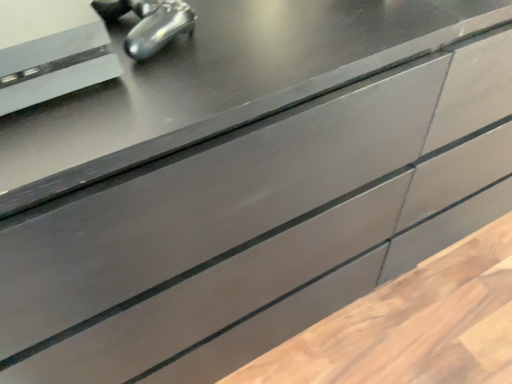
Consider the image. In order to face metallic silver tap at upper left, should I rotate leftwards or rightwards?

To face it directly, rotate left by 13.814 degrees.

The width and height of the screenshot is (512, 384). I want to click on metallic silver tap at upper left, so click(x=149, y=23).

Image resolution: width=512 pixels, height=384 pixels. Describe the element at coordinates (149, 23) in the screenshot. I see `metallic silver tap at upper left` at that location.

You are a GUI agent. You are given a task and a screenshot of the screen. Output one action in this format:
    pyautogui.click(x=<x>, y=<y>)
    Task: Click on the metallic silver tap at upper left
    
    Given the screenshot: What is the action you would take?
    pyautogui.click(x=149, y=23)